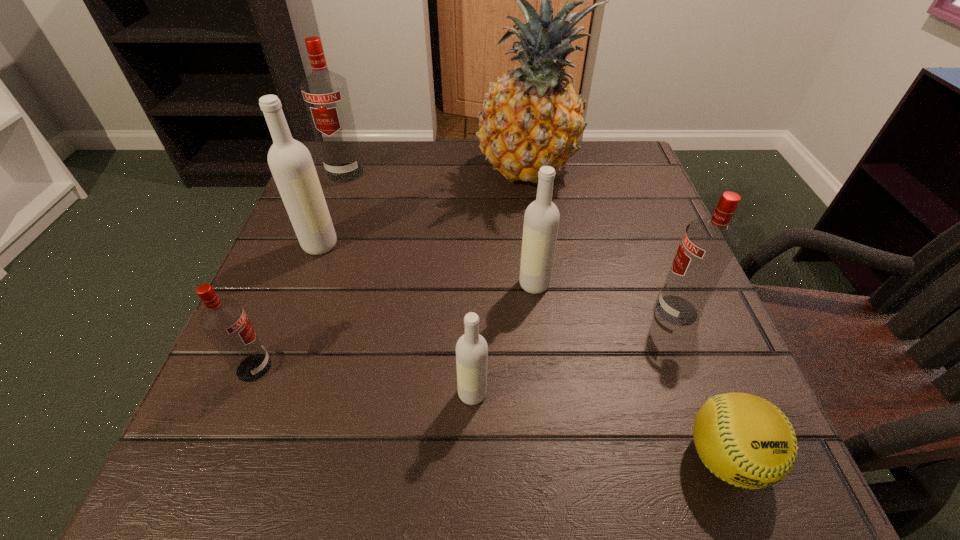
You are a GUI agent. You are given a task and a screenshot of the screen. Output one action in this format:
    pyautogui.click(x=<x>, y=<y>)
    Task: Click on the object that is at the far left corner
    The width and height of the screenshot is (960, 540).
    Given the screenshot: What is the action you would take?
    pyautogui.click(x=325, y=93)

Find the location of a particular element. object positioned at the far right corner is located at coordinates (532, 117).

This screenshot has width=960, height=540. What are the coordinates of `object that is at the near right corner` in the screenshot? It's located at (745, 440).

Identify the location of blank area at the far edge. The width and height of the screenshot is (960, 540). (451, 144).

I want to click on free spot at the near edge of the desktop, so click(x=551, y=482).

Find the location of `free space at the left edge`. free space at the left edge is located at coordinates (228, 377).

I want to click on vacant region at the right edge of the desktop, so click(x=682, y=379).

This screenshot has height=540, width=960. In order to click on free spot at the near left corner of the desktop in this screenshot , I will do `click(257, 465)`.

This screenshot has width=960, height=540. In the image, there is a desktop. In order to click on vacant space at the far right corner in this screenshot , I will do `click(600, 190)`.

The height and width of the screenshot is (540, 960). I want to click on vacant area that lies between the nearest red vodka and the farthest white vodka, so click(x=287, y=306).